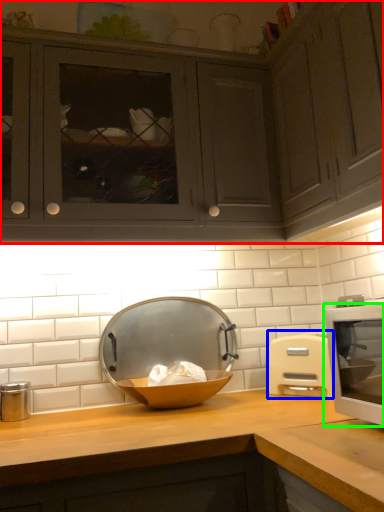
Question: Which is nearer to the cabinetry (highlighted by a red box)? microwave oven (highlighted by a blue box) or home appliance (highlighted by a green box).

Choices:
 (A) microwave oven
 (B) home appliance

Answer: (B)